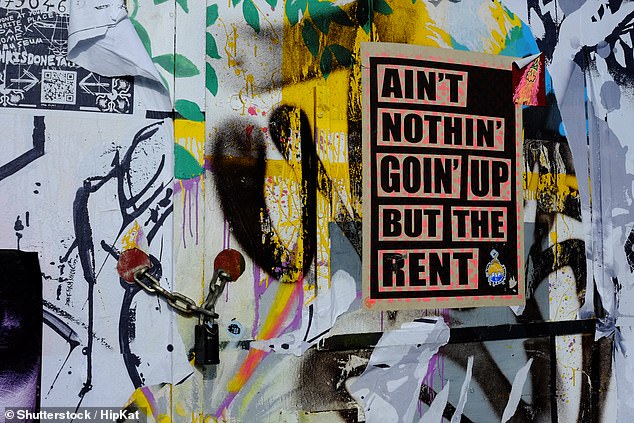
Locate an element on the screen. wall is located at coordinates [574, 119].